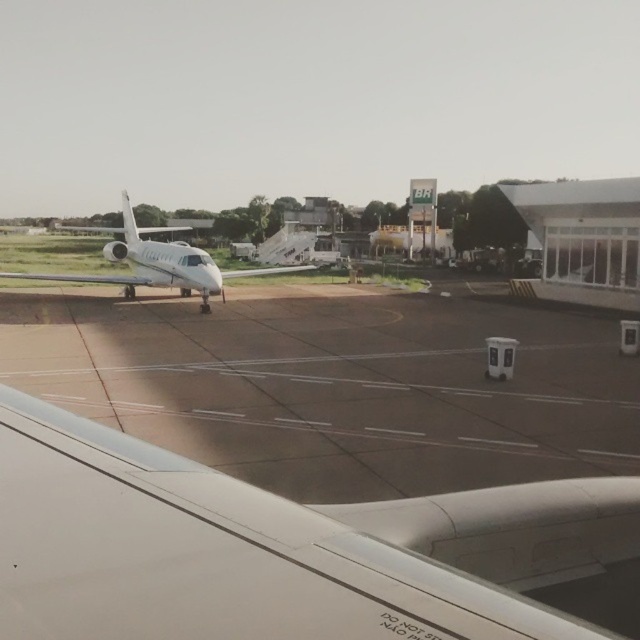
You are a passenger sitting at point (177, 298) and want to move to point (195, 253). Which direction should you walk to get closer to your destination?

You should walk away from the camera because point (177, 298) is further to the camera than point (195, 253).

You are a pilot preparing to board a plane. You see the white matte wing at upper left and the white glossy airplane at left. Which object is closer to the boarding gate?

The white glossy airplane at left is closer to the boarding gate since it is connected to the jet bridge, while the white matte wing at upper left belongs to another aircraft, likely parked farther away.

You are a delivery drone operator. Your drone needs to deliver a package from the dark gray asphalt at center to the clear glass airplane window at center. What is the minimum distance the drone must travel?

The minimum distance the drone must travel is 22.63 feet, as the dark gray asphalt at center and clear glass airplane window at center are 22.63 feet apart from each other.